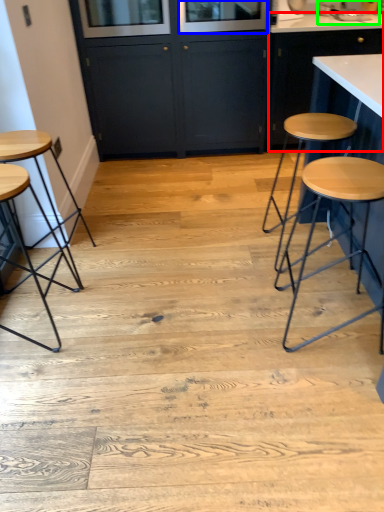
Question: Which object is positioned closest to cabinetry (highlighted by a red box)? Select from window screen (highlighted by a blue box) and sink (highlighted by a green box).

Choices:
 (A) window screen
 (B) sink

Answer: (A)